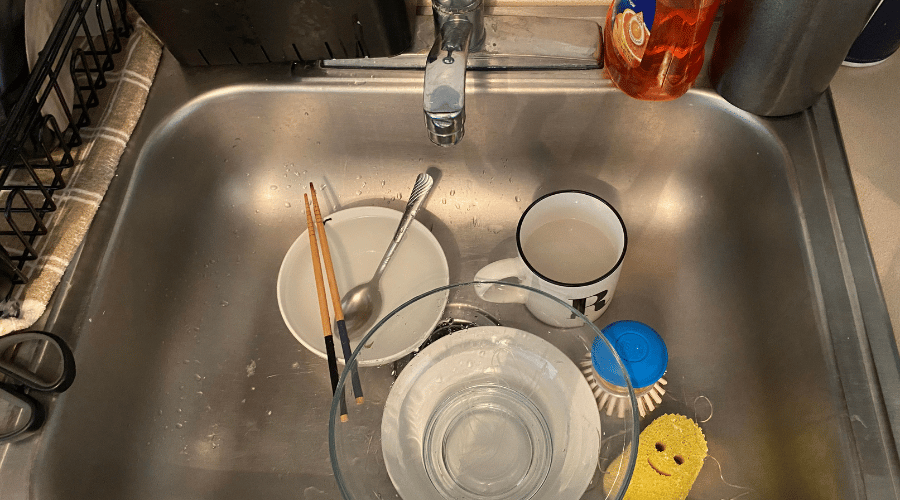
Identify the location of clear bowl. Image resolution: width=900 pixels, height=500 pixels. (601, 388).